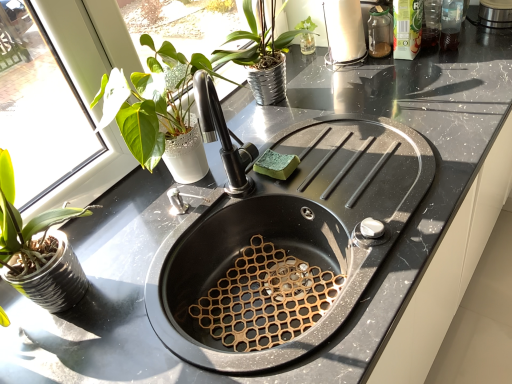
Locate an element on the screen. The width and height of the screenshot is (512, 384). free point to the left of green sponge at sink is located at coordinates (224, 196).